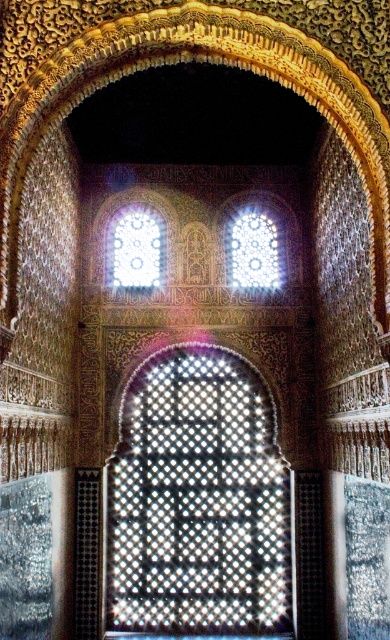
Question: Can you confirm if translucent mosaic at center is positioned to the right of translucent glass window at upper center?

Choices:
 (A) yes
 (B) no

Answer: (B)

Question: Is translucent mosaic at center above translucent glass window at upper center?

Choices:
 (A) no
 (B) yes

Answer: (A)

Question: Does translucent mosaic at center appear over translucent glass window at upper center?

Choices:
 (A) yes
 (B) no

Answer: (B)

Question: Which point is farther to the camera?

Choices:
 (A) transparent glass at upper center
 (B) translucent mosaic at center
 (C) translucent glass window at upper center

Answer: (C)

Question: Which point is closer to the camera?

Choices:
 (A) transparent glass at upper center
 (B) translucent mosaic at center
 (C) translucent glass window at upper center

Answer: (B)

Question: Which object appears farthest from the camera in this image?

Choices:
 (A) translucent glass window at upper center
 (B) transparent glass at upper center

Answer: (A)